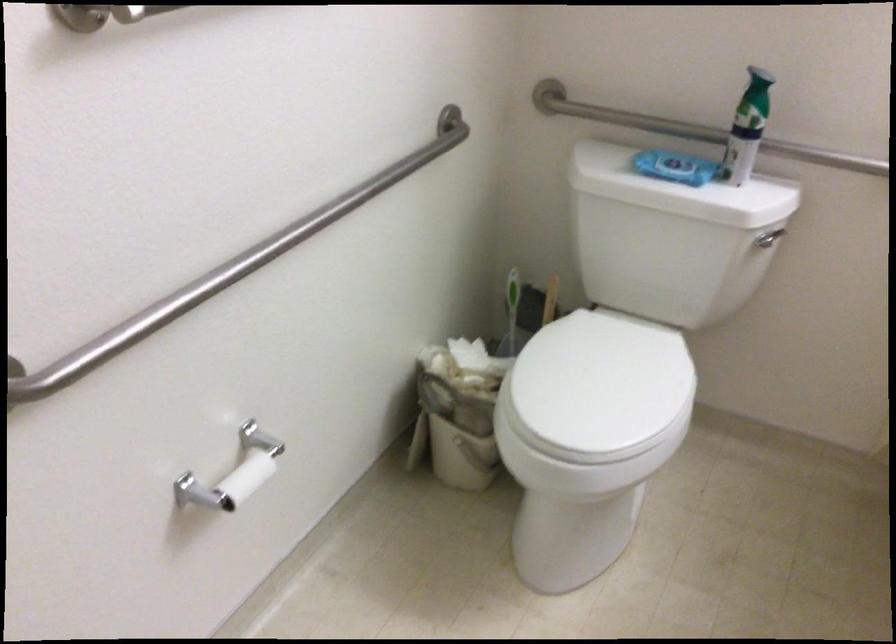
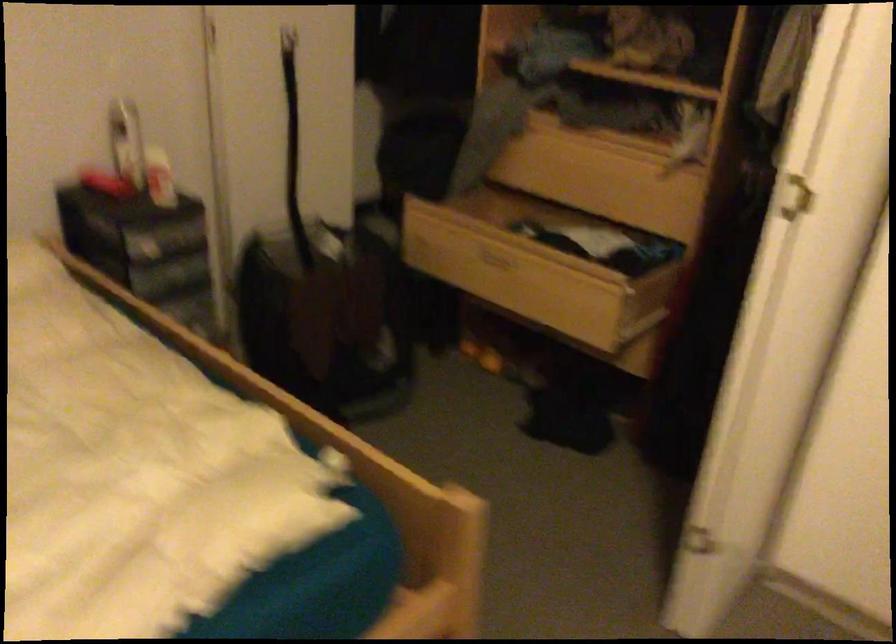
Question: I am providing you with two images of the same scene from different viewpoints. After the viewpoint changes to image2, which objects are now occluded?

Choices:
 (A) white door handle
 (B) open wooden drawer
 (C) white wall control
 (D) white toilet seat

Answer: (D)